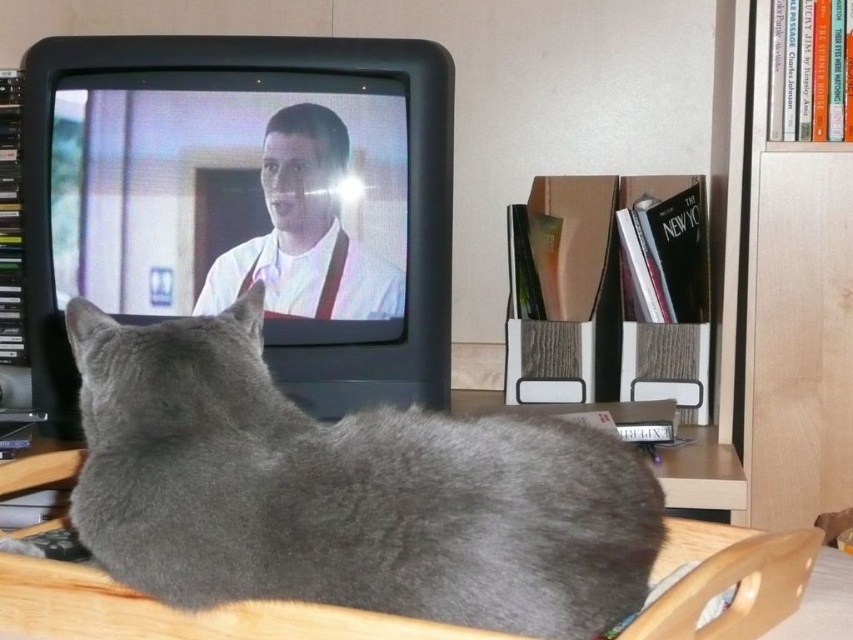
Question: Is gray fur cat at center positioned before light brown wood bookshelf at right?

Choices:
 (A) yes
 (B) no

Answer: (A)

Question: Is gray fur cat at center closer to the viewer compared to light brown wood bookshelf at right?

Choices:
 (A) no
 (B) yes

Answer: (B)

Question: Among these points, which one is farthest from the camera?

Choices:
 (A) (820, 346)
 (B) (228, 516)

Answer: (A)

Question: Is gray fur cat at center closer to the viewer compared to light brown wood bookshelf at right?

Choices:
 (A) no
 (B) yes

Answer: (B)